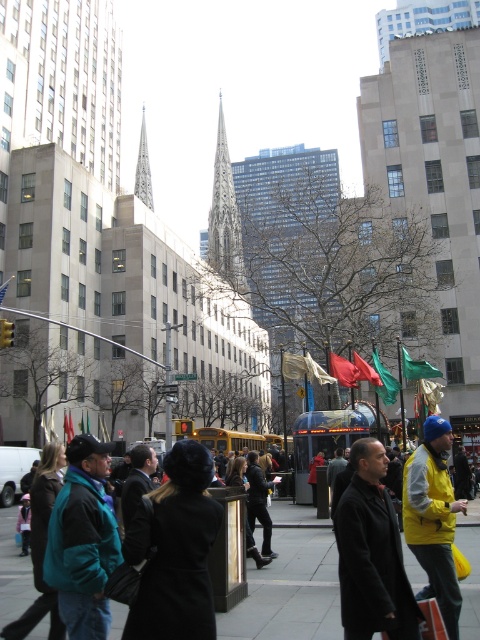
Does point (360, 618) come closer to viewer compared to point (116, 545)?

Yes.

Who is shorter, black matte coat at center or teal fleece jacket at lower left?

Standing shorter between the two is black matte coat at center.

Which is behind, point (346, 602) or point (93, 627)?

Point (346, 602)

This screenshot has width=480, height=640. Find the location of `black matte coat at center`. black matte coat at center is located at coordinates (372, 554).

Image resolution: width=480 pixels, height=640 pixels. Describe the element at coordinates (225, 218) in the screenshot. I see `carved stone spire at center` at that location.

Which of these two, carved stone spire at center or silver metallic spire at center, stands taller?

With more height is carved stone spire at center.

Is point (214, 240) closer to camera compared to point (141, 188)?

Yes, point (214, 240) is closer to viewer.

Identify the location of carved stone spire at center. Image resolution: width=480 pixels, height=640 pixels. point(225,218).

Can you confirm if smooth concrete pavement at center is bigger than carved stone spire at center?

Incorrect, smooth concrete pavement at center is not larger than carved stone spire at center.

In the scene shown: Who is higher up, smooth concrete pavement at center or carved stone spire at center?

carved stone spire at center is above.

Is point (287, 611) positioned behind point (220, 152)?

No, it is not.

Locate an element on the screen. This screenshot has width=480, height=640. smooth concrete pavement at center is located at coordinates (290, 584).